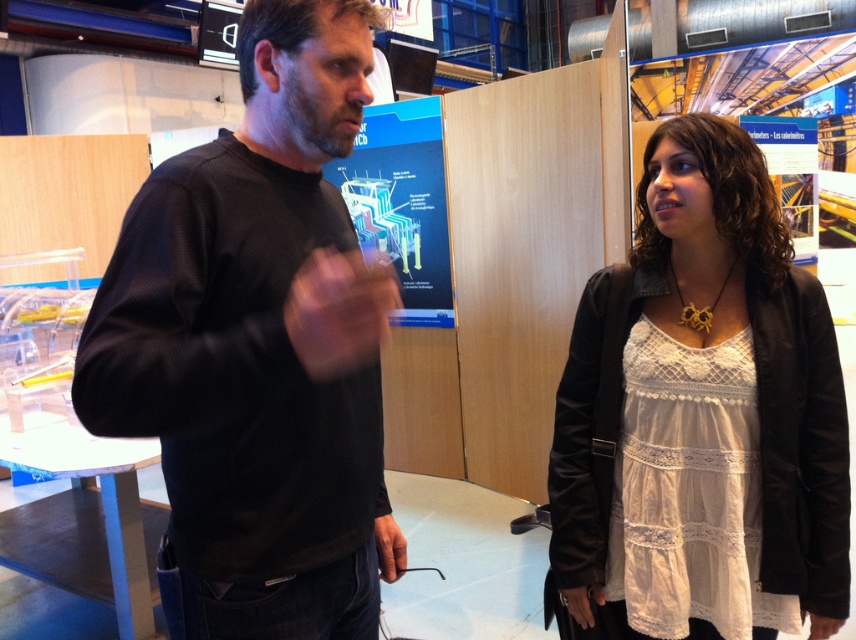
You are a photographer setting up a shoot in this scene. You need to position a spotlight that can cover both the black matte sweater at left and the white lace dress at center. Considering their heights, which object should the spotlight be angled downward towards?

The spotlight should be angled downward towards the white lace dress at center because the black matte sweater at left has a greater height compared to white lace dress at center, meaning the dress is shorter and requires downward lighting.

You are standing in the exhibition hall and see two points marked in the scene. The first point is at coordinate point (302, 120) and the second is at point (620, 492). Which point is closer to you?

Point (302, 120) is closer to the viewer than point (620, 492).

You are a photographer setting up for a group photo. You need to position yourself so that both the black matte sweater at left and the white lace dress at center are fully visible in your shot. Based on their positions, which direction should you avoid pointing your camera to ensure both are in frame?

You should avoid pointing the camera towards the direction where the black matte sweater at left is located because it is in front of the white lace dress at center. This positioning might block the view of the white lace dress at center if the camera is aimed directly at the black matte sweater at left.